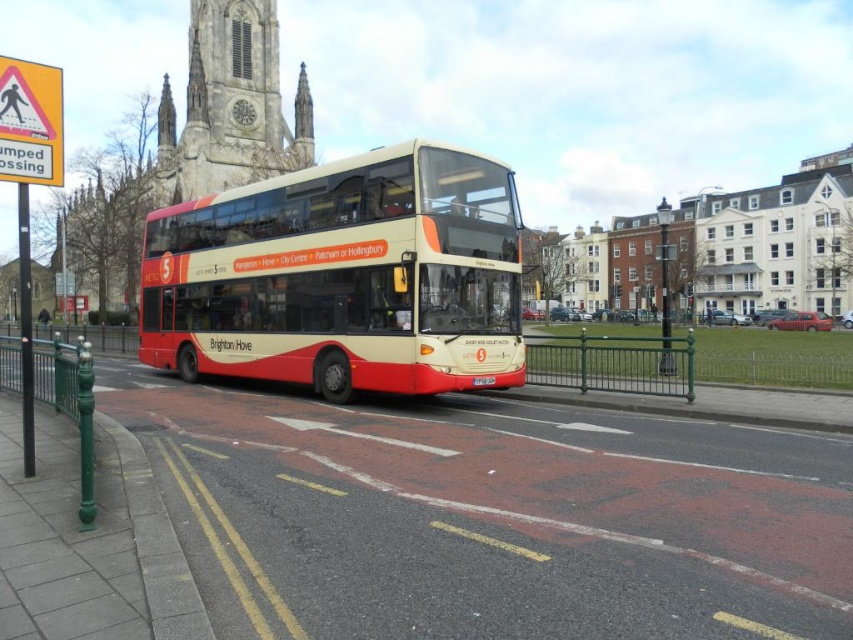
Question: Which object is farther from the camera taking this photo?

Choices:
 (A) green metal fence at lower center
 (B) yellow plastic pedestrian crossing sign at upper left
 (C) matte beige-decked bus at center
 (D) white plastic license plate at center

Answer: (A)

Question: Considering the real-world distances, which object is closest to the yellow plastic pedestrian crossing sign at upper left?

Choices:
 (A) white plastic license plate at center
 (B) matte beige-decked bus at center

Answer: (B)

Question: Which of these objects is positioned farthest from the green metal fence at lower center?

Choices:
 (A) matte beige-decked bus at center
 (B) white plastic license plate at center
 (C) yellow plastic pedestrian crossing sign at upper left

Answer: (C)

Question: Is matte beige-decked bus at center to the left of green metal fence at lower center from the viewer's perspective?

Choices:
 (A) no
 (B) yes

Answer: (B)

Question: Can you confirm if matte beige-decked bus at center is bigger than yellow plastic pedestrian crossing sign at upper left?

Choices:
 (A) no
 (B) yes

Answer: (B)

Question: Can you confirm if green metal fence at lower center is wider than white plastic license plate at center?

Choices:
 (A) no
 (B) yes

Answer: (B)